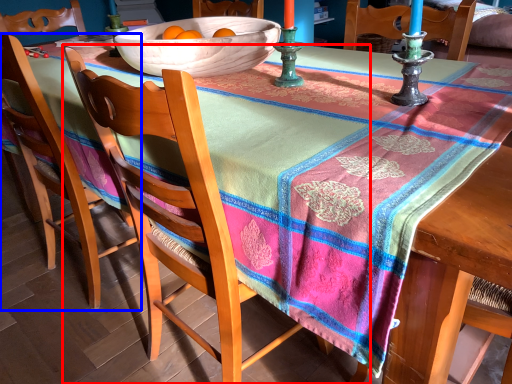
Question: Which object is closer to the camera taking this photo, chair (highlighted by a red box) or chair (highlighted by a blue box)?

Choices:
 (A) chair
 (B) chair

Answer: (A)